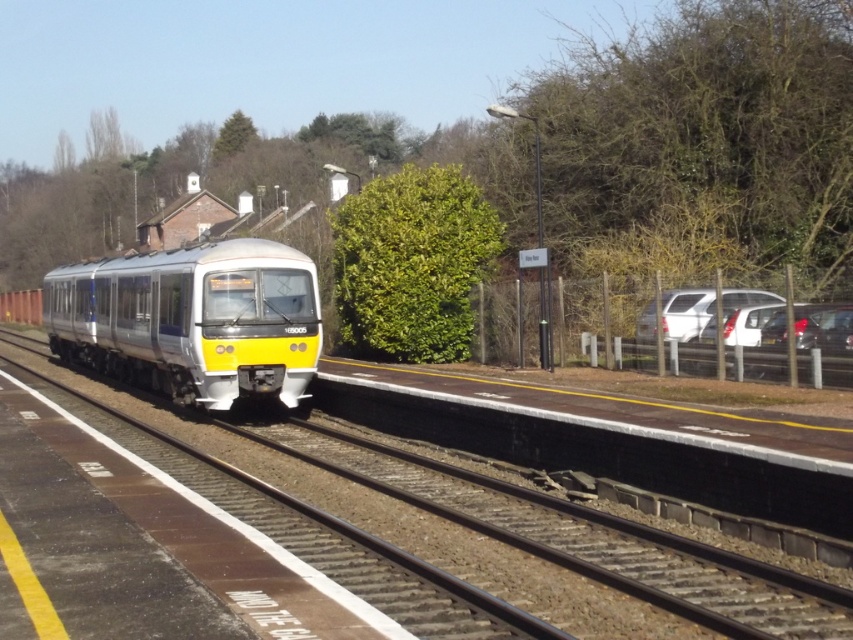
Question: Where is silver metallic train at center located in relation to smooth metal train track at center in the image?

Choices:
 (A) left
 (B) right

Answer: (A)

Question: Does silver metallic train at center have a lesser width compared to smooth metal train track at center?

Choices:
 (A) no
 (B) yes

Answer: (A)

Question: Is silver metallic train at center to the left of smooth metal train track at center from the viewer's perspective?

Choices:
 (A) no
 (B) yes

Answer: (B)

Question: Which point is closer to the camera?

Choices:
 (A) (119, 365)
 (B) (364, 468)

Answer: (B)

Question: Among these points, which one is farthest from the camera?

Choices:
 (A) (73, 268)
 (B) (735, 580)

Answer: (A)